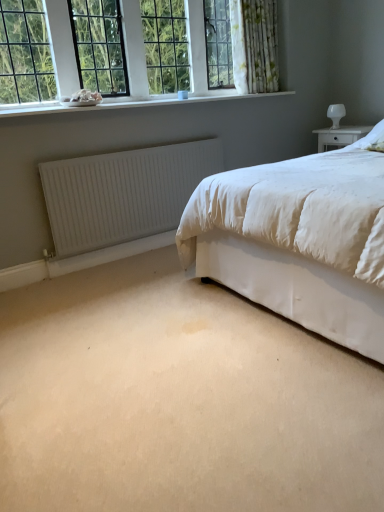
Question: From the image's perspective, relative to white matte radiator at lower left, is clear glass window at upper left above or below?

Choices:
 (A) above
 (B) below

Answer: (A)

Question: From a real-world perspective, is clear glass window at upper left positioned above or below white matte radiator at lower left?

Choices:
 (A) above
 (B) below

Answer: (A)

Question: Which object is the farthest from the white matte radiator at lower left?

Choices:
 (A) white glossy table lamp at upper right
 (B) clear glass window at upper left
 (C) white smooth window sill at upper left
 (D) white floral fabric curtain at upper center

Answer: (A)

Question: Estimate the real-world distances between objects in this image. Which object is closer to the white glossy table lamp at upper right?

Choices:
 (A) white smooth window sill at upper left
 (B) clear glass window at upper left
 (C) white floral fabric curtain at upper center
 (D) white matte radiator at lower left

Answer: (C)